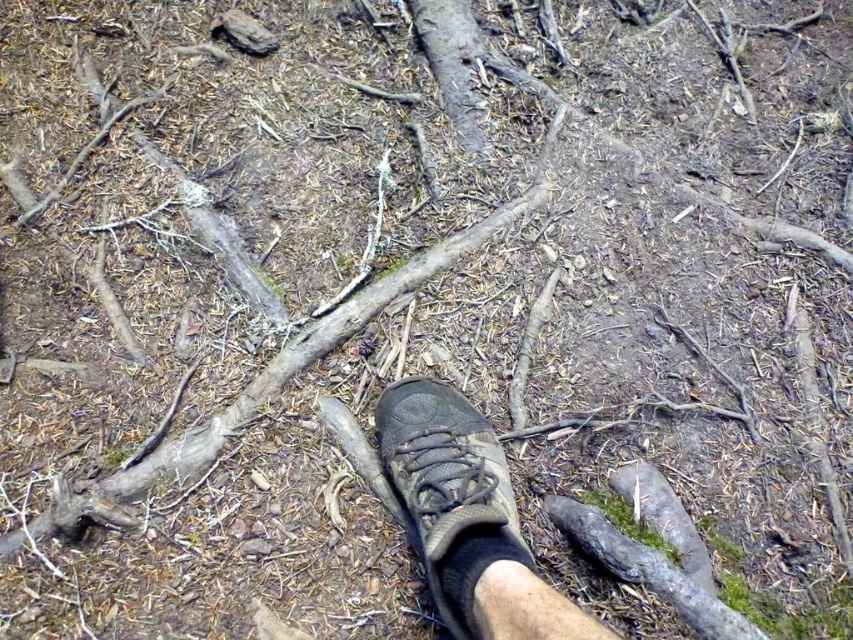
Between brown suede shoe at center and brown rough wood at center, which one has more height?

Standing taller between the two is brown rough wood at center.

Does brown suede shoe at center lie in front of brown rough wood at center?

Yes, brown suede shoe at center is closer to the viewer.

Between point (479, 611) and point (22, 532), which one is positioned in front?

Point (479, 611) is in front.

The height and width of the screenshot is (640, 853). I want to click on brown suede shoe at center, so click(468, 518).